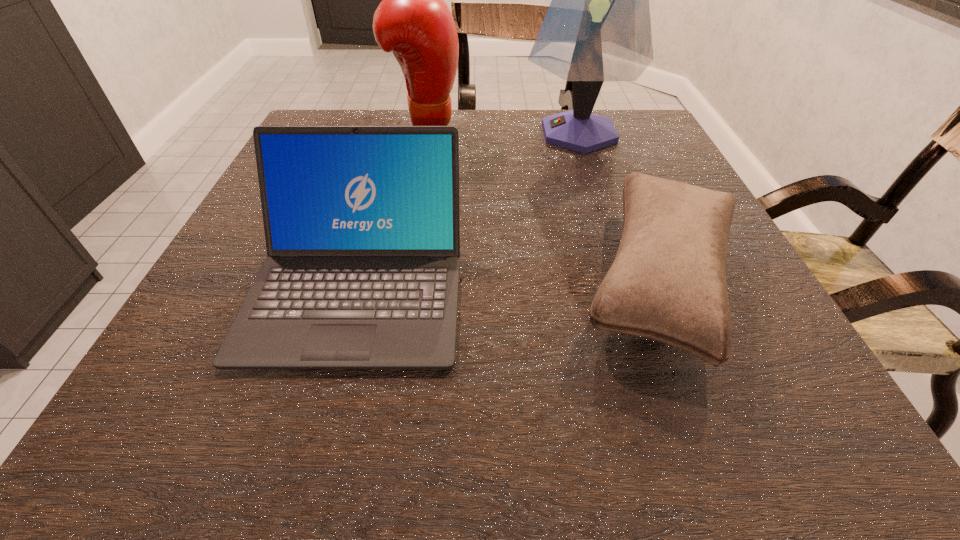
Find the location of a particular element. The width and height of the screenshot is (960, 540). free spot at the right edge of the desktop is located at coordinates (670, 157).

This screenshot has width=960, height=540. Find the location of `vacant space at the near left corner of the desktop`. vacant space at the near left corner of the desktop is located at coordinates (235, 420).

This screenshot has height=540, width=960. In the image, there is a desktop. Find the location of `vacant space at the near right corner`. vacant space at the near right corner is located at coordinates (736, 414).

At what (x,y) coordinates should I click in order to perform the action: click on free space between the third tallest object and the shortest object. Please return your answer as a coordinate pair (x, y). Image resolution: width=960 pixels, height=540 pixels. Looking at the image, I should click on (509, 281).

The image size is (960, 540). What are the coordinates of `empty space that is in between the third tallest object and the cushion` in the screenshot? It's located at (509, 281).

This screenshot has width=960, height=540. What are the coordinates of `vacant area that lies between the cushion and the second tallest object` in the screenshot? It's located at (542, 204).

Where is `free space between the shortest object and the third shortest object`? This screenshot has height=540, width=960. free space between the shortest object and the third shortest object is located at coordinates (542, 204).

Where is `empty location between the shortest object and the laptop computer`? empty location between the shortest object and the laptop computer is located at coordinates (509, 281).

Find the location of a particular element. The height and width of the screenshot is (540, 960). free space that is in between the shortest object and the second tallest object is located at coordinates (542, 204).

I want to click on empty location between the third shortest object and the tallest object, so click(502, 131).